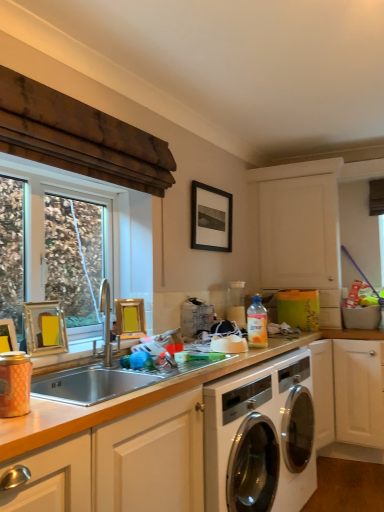
Question: From the image's perspective, is matte pink canister at left over gold metallic picture frame at left, the 4th picture frame in the back-to-front sequence?

Choices:
 (A) yes
 (B) no

Answer: (B)

Question: Is the surface of matte pink canister at left in direct contact with gold metallic picture frame at left, the 4th picture frame in the back-to-front sequence?

Choices:
 (A) yes
 (B) no

Answer: (B)

Question: Can you confirm if matte pink canister at left is smaller than gold metallic picture frame at left, which appears as the second picture frame when ordered from the bottom?

Choices:
 (A) yes
 (B) no

Answer: (A)

Question: Does matte pink canister at left have a lesser height compared to gold metallic picture frame at left, the 4th picture frame in the back-to-front sequence?

Choices:
 (A) no
 (B) yes

Answer: (B)

Question: Can you confirm if matte pink canister at left is thinner than gold metallic picture frame at left, acting as the first picture frame starting from the front?

Choices:
 (A) yes
 (B) no

Answer: (B)

Question: Is yellow matte picture frame at sink, which ranks as the 1th picture frame in bottom-to-top order, in front of or behind gold metallic picture frame at left, the 2th picture frame in the top-to-bottom sequence, in the image?

Choices:
 (A) front
 (B) behind

Answer: (B)

Question: Considering the relative positions of yellow matte picture frame at sink, placed as the 2th picture frame when sorted from back to front, and gold metallic picture frame at left, placed as the third picture frame when sorted from back to front, in the image provided, is yellow matte picture frame at sink, placed as the 2th picture frame when sorted from back to front, to the left or to the right of gold metallic picture frame at left, placed as the third picture frame when sorted from back to front,?

Choices:
 (A) right
 (B) left

Answer: (A)

Question: From a real-world perspective, relative to gold metallic picture frame at left, the 3th picture frame positioned from the right, is yellow matte picture frame at sink, which is counted as the 4th picture frame, starting from the top, vertically above or below?

Choices:
 (A) below
 (B) above

Answer: (A)

Question: Considering the positions of yellow matte picture frame at sink, which ranks as the 1th picture frame in bottom-to-top order, and gold metallic picture frame at left, the 2th picture frame in the top-to-bottom sequence, in the image, is yellow matte picture frame at sink, which ranks as the 1th picture frame in bottom-to-top order, bigger or smaller than gold metallic picture frame at left, the 2th picture frame in the top-to-bottom sequence,?

Choices:
 (A) big
 (B) small

Answer: (B)

Question: In terms of height, does yellow matte picture frame at sink, which is counted as the third picture frame, starting from the left, look taller or shorter compared to gold metallic picture frame at left, which appears as the second picture frame when ordered from the bottom?

Choices:
 (A) short
 (B) tall

Answer: (B)

Question: Relative to gold metallic picture frame at left, the 4th picture frame viewed from the right, is yellow matte picture frame at sink, which ranks as the 1th picture frame in bottom-to-top order, in front or behind?

Choices:
 (A) behind
 (B) front

Answer: (A)

Question: Is yellow matte picture frame at sink, which is counted as the 4th picture frame, starting from the top, to the left or to the right of gold metallic picture frame at left, which ranks as the third picture frame in top-to-bottom order, in the image?

Choices:
 (A) left
 (B) right

Answer: (B)

Question: Which is correct: yellow matte picture frame at sink, which ranks as the 3th picture frame in front-to-back order, is inside gold metallic picture frame at left, acting as the first picture frame starting from the front, or outside of it?

Choices:
 (A) outside
 (B) inside

Answer: (A)

Question: Is point (205, 239) closer or farther from the camera than point (3, 397)?

Choices:
 (A) closer
 (B) farther

Answer: (B)

Question: Based on their sizes in the image, would you say black matte picture frame at upper center, which appears as the fourth picture frame when viewed from the front, is bigger or smaller than matte pink canister at left?

Choices:
 (A) small
 (B) big

Answer: (B)